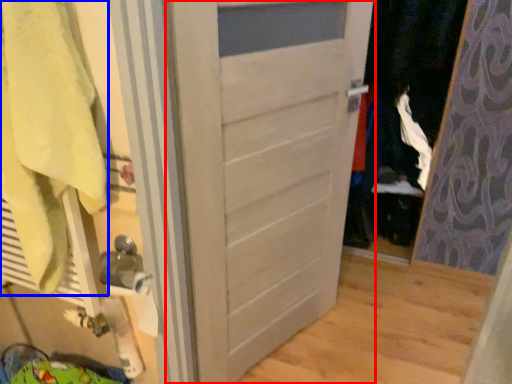
Question: Which object appears farthest to the camera in this image, door (highlighted by a red box) or bath towel (highlighted by a blue box)?

Choices:
 (A) door
 (B) bath towel

Answer: (A)